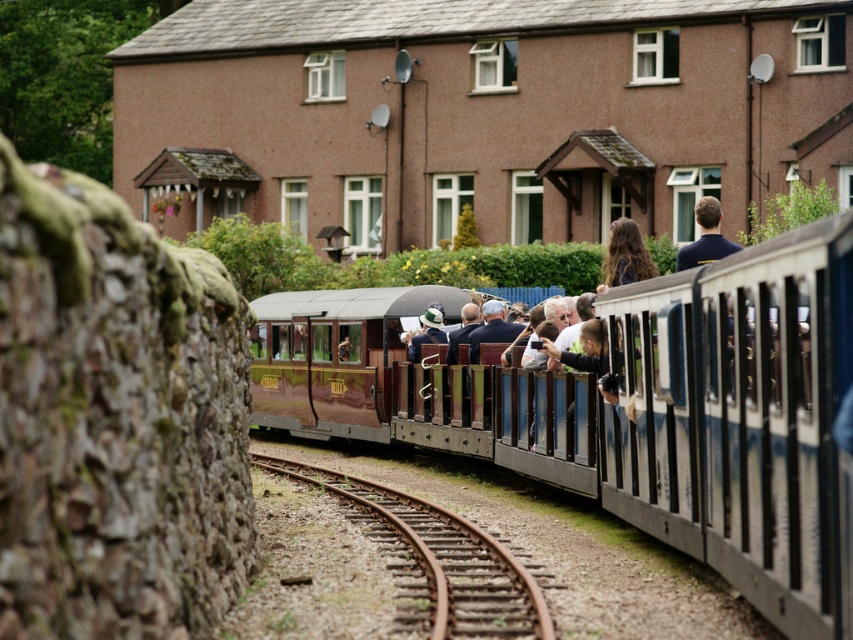
In the scene shown: You are a photographer planning to capture the entire rusty metal train track at lower center and the long brown hair at upper center in a single frame. Considering their sizes, which object would appear larger in the photo?

The rusty metal train track at lower center would appear larger in the photo because its width surpasses that of the long brown hair at upper center.

You are a photographer standing on the platform next to the train. You want to take a photo that includes both the polished wood train car at center and the dark blue shirt at upper right. Which object should be placed closer to the camera to ensure both are in focus?

The polished wood train car at center is shorter than the dark blue shirt at upper right, so to ensure both are in focus, the dark blue shirt at upper right should be placed closer to the camera.